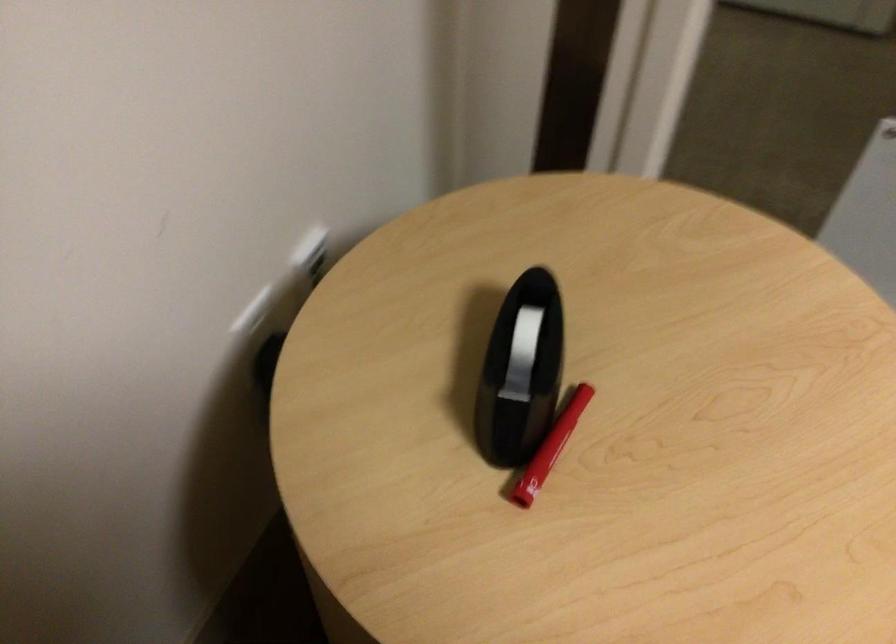
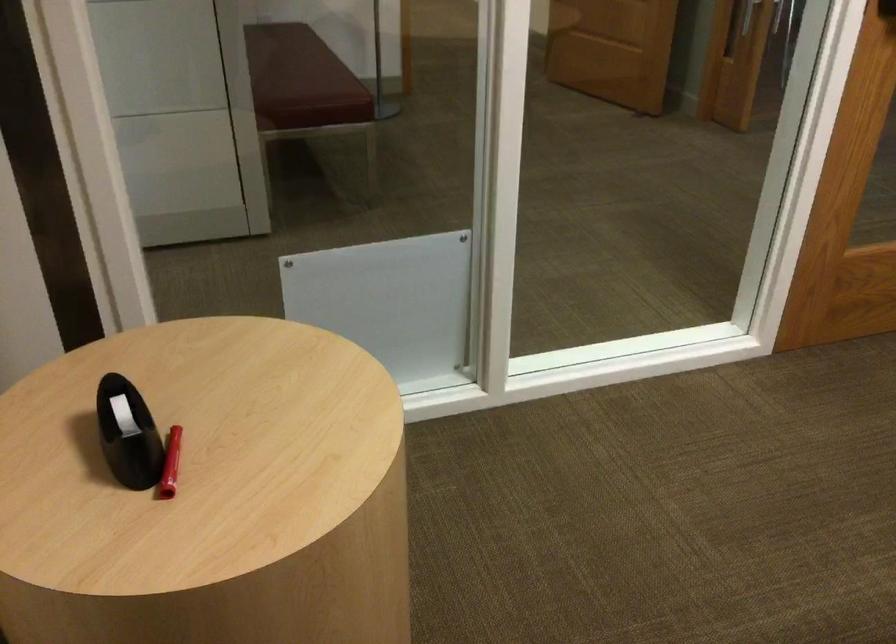
Question: The camera is either moving clockwise (left) or counter-clockwise (right) around the object. The first image is from the beginning of the video and the second image is from the end. Is the camera moving left or right when shooting the video?

Choices:
 (A) Left
 (B) Right

Answer: (A)